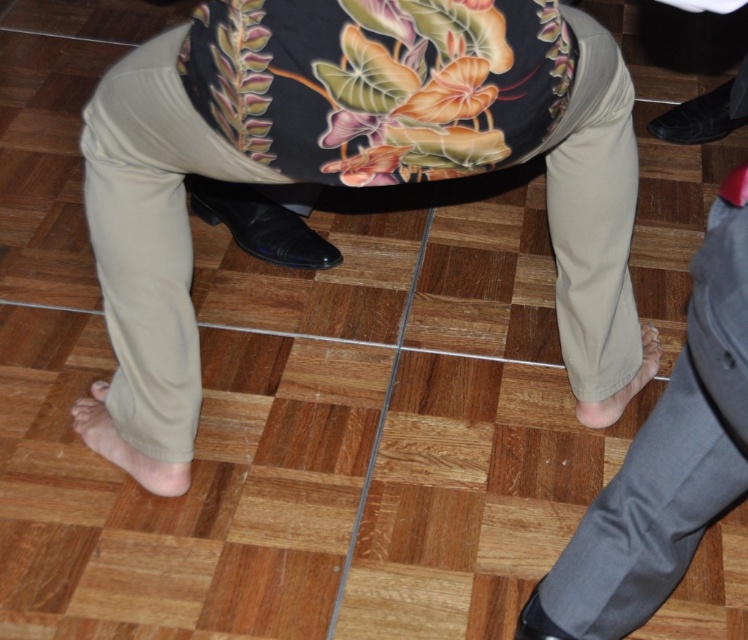
Question: Does black leather shoe at lower left appear on the left side of tan fabric foot at lower right?

Choices:
 (A) no
 (B) yes

Answer: (B)

Question: Which object is the farthest from the black leather shoe at lower left?

Choices:
 (A) tan fabric foot at lower right
 (B) barefoot at lower left

Answer: (A)

Question: Which object is closer to the camera taking this photo?

Choices:
 (A) black leather shoe at lower left
 (B) matte khaki pants at center

Answer: (B)

Question: Does barefoot at lower left have a smaller size compared to tan fabric foot at lower right?

Choices:
 (A) yes
 (B) no

Answer: (B)

Question: Which is farther from the black leather shoe at lower left?

Choices:
 (A) barefoot at lower left
 (B) tan fabric foot at lower right
 (C) matte khaki pants at center

Answer: (B)

Question: Can you confirm if black leather shoe at lower left is bigger than tan fabric foot at lower right?

Choices:
 (A) yes
 (B) no

Answer: (A)